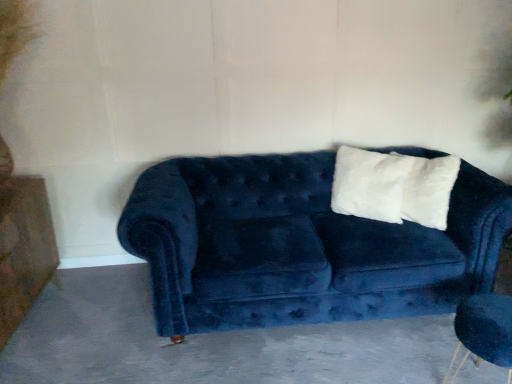
Question: Is white fluffy pillow at upper right further to the viewer compared to velvet blue armchair at lower right?

Choices:
 (A) yes
 (B) no

Answer: (A)

Question: Considering the relative sizes of white fluffy pillow at upper right and velvet blue armchair at lower right in the image provided, is white fluffy pillow at upper right smaller than velvet blue armchair at lower right?

Choices:
 (A) no
 (B) yes

Answer: (B)

Question: From the image's perspective, is white fluffy pillow at upper right below velvet blue armchair at lower right?

Choices:
 (A) yes
 (B) no

Answer: (B)

Question: Is white fluffy pillow at upper right positioned in front of velvet blue armchair at lower right?

Choices:
 (A) yes
 (B) no

Answer: (B)

Question: From a real-world perspective, is white fluffy pillow at upper right located beneath velvet blue armchair at lower right?

Choices:
 (A) no
 (B) yes

Answer: (A)

Question: Relative to dark gray concrete at center, is velvet blue couch at center in front or behind?

Choices:
 (A) behind
 (B) front

Answer: (A)

Question: Is velvet blue couch at center to the left or to the right of dark gray concrete at center in the image?

Choices:
 (A) right
 (B) left

Answer: (B)

Question: From a real-world perspective, is velvet blue couch at center physically located above or below dark gray concrete at center?

Choices:
 (A) below
 (B) above

Answer: (B)

Question: Considering the positions of velvet blue couch at center and dark gray concrete at center in the image, is velvet blue couch at center taller or shorter than dark gray concrete at center?

Choices:
 (A) short
 (B) tall

Answer: (B)

Question: Is point (347, 339) positioned closer to the camera than point (497, 307)?

Choices:
 (A) farther
 (B) closer

Answer: (A)

Question: Considering the positions of dark gray concrete at center and velvet blue armchair at lower right in the image, is dark gray concrete at center wider or thinner than velvet blue armchair at lower right?

Choices:
 (A) thin
 (B) wide

Answer: (B)

Question: From a real-world perspective, is dark gray concrete at center positioned above or below velvet blue armchair at lower right?

Choices:
 (A) above
 (B) below

Answer: (B)

Question: Is dark gray concrete at center inside or outside of velvet blue armchair at lower right?

Choices:
 (A) inside
 (B) outside

Answer: (B)

Question: From the image's perspective, is dark gray concrete at center located above or below white fluffy pillow at upper right?

Choices:
 (A) below
 (B) above

Answer: (A)

Question: Considering the relative positions of dark gray concrete at center and white fluffy pillow at upper right in the image provided, is dark gray concrete at center to the left or to the right of white fluffy pillow at upper right?

Choices:
 (A) right
 (B) left

Answer: (B)